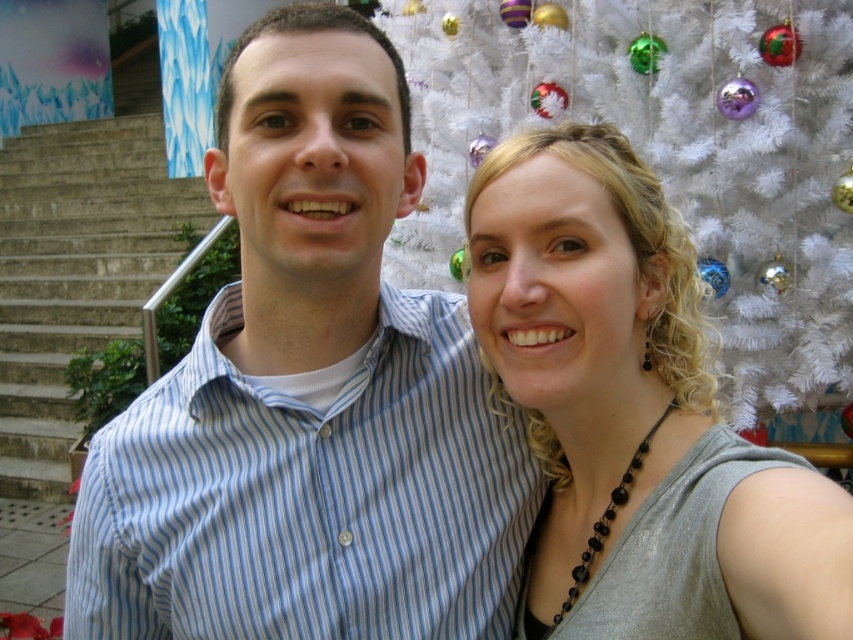
You are trying to decide whether to place a small potted plant on the matte gray tank top at center or the gray concrete stairs at left. Based on their heights, which surface can the plant be placed on without being hidden?

The matte gray tank top at center is shorter than the gray concrete stairs at left, so placing the plant on the gray concrete stairs at left would ensure it isn